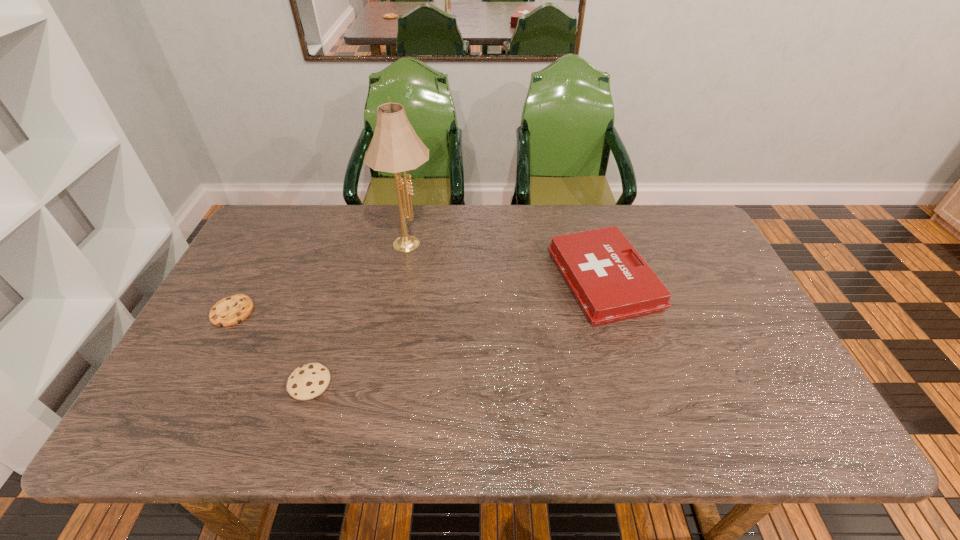
Where is `vacant space located on the left of the nearest object`? This screenshot has height=540, width=960. vacant space located on the left of the nearest object is located at coordinates (252, 383).

Locate an element on the screen. The image size is (960, 540). vacant space located 0.080m on the right of the shorter cookie is located at coordinates point(282,311).

Identify the location of lampshade located at the far edge. The image size is (960, 540). (395, 147).

Where is `the first-aid kit at the far edge`? The width and height of the screenshot is (960, 540). the first-aid kit at the far edge is located at coordinates pos(610,284).

What are the coordinates of `object present at the left edge` in the screenshot? It's located at (234, 309).

You are a GUI agent. You are given a task and a screenshot of the screen. Output one action in this format:
    pyautogui.click(x=<x>, y=<y>)
    Task: Click on the vacant space at the far edge of the desktop
    The image size is (960, 540).
    Given the screenshot: What is the action you would take?
    pyautogui.click(x=441, y=229)

Find the location of a particular element. The width and height of the screenshot is (960, 540). free point at the near edge is located at coordinates (410, 419).

The width and height of the screenshot is (960, 540). What are the coordinates of `vacant region at the left edge` in the screenshot? It's located at (242, 282).

Identify the location of free space at the right edge of the desktop. The height and width of the screenshot is (540, 960). (746, 369).

You are a GUI agent. You are given a task and a screenshot of the screen. Output one action in this format:
    pyautogui.click(x=<x>, y=<y>)
    Task: Click on the free region at the far left corner
    The image size is (960, 540).
    Given the screenshot: What is the action you would take?
    pyautogui.click(x=291, y=241)